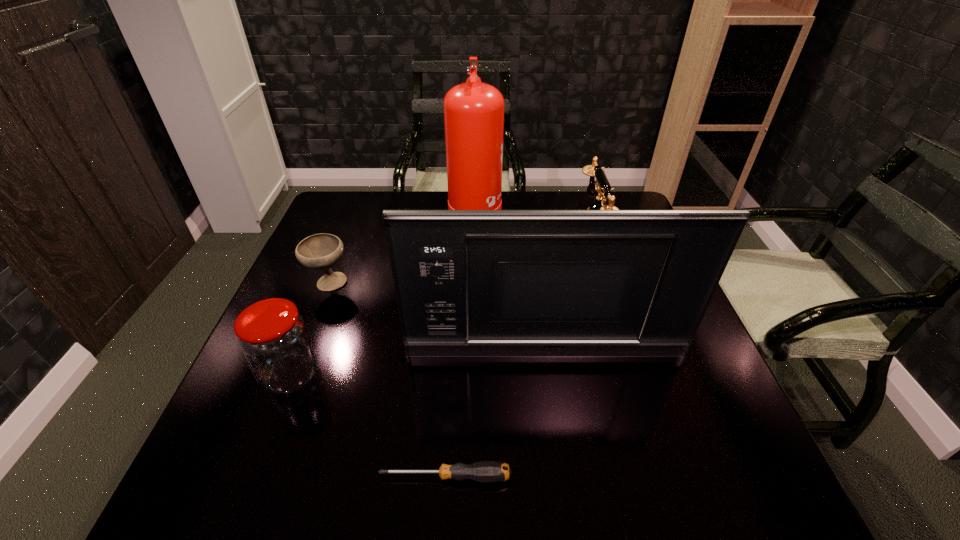
The image size is (960, 540). I want to click on vacant space located on the dial of the telephone, so click(x=516, y=239).

I want to click on vacant area situated 0.310m on the dial of the telephone, so click(x=461, y=239).

Find the location of `vacant space situated 0.090m on the dial of the telephone`. vacant space situated 0.090m on the dial of the telephone is located at coordinates (537, 239).

Find the location of a particular element. This screenshot has height=540, width=960. vacant space positioned on the back of the jar is located at coordinates (343, 244).

Identify the location of free location located on the front of the fifth tallest object. (290, 386).

At what (x,y) coordinates should I click in order to perform the action: click on vacant space located 0.390m on the back of the screwdriver. Please return your answer as a coordinate pair (x, y). The height and width of the screenshot is (540, 960). Looking at the image, I should click on (455, 309).

Identify the location of fire extinguisher positioned at the far edge. (473, 111).

Image resolution: width=960 pixels, height=540 pixels. I want to click on telephone at the far edge, so click(602, 186).

This screenshot has height=540, width=960. What are the coordinates of `object positioned at the near edge` in the screenshot? It's located at (484, 471).

You are a GUI agent. You are given a task and a screenshot of the screen. Output one action in this format:
    pyautogui.click(x=<x>, y=<y>)
    Task: Click on the jar that is at the left edge
    
    Given the screenshot: What is the action you would take?
    pyautogui.click(x=273, y=337)